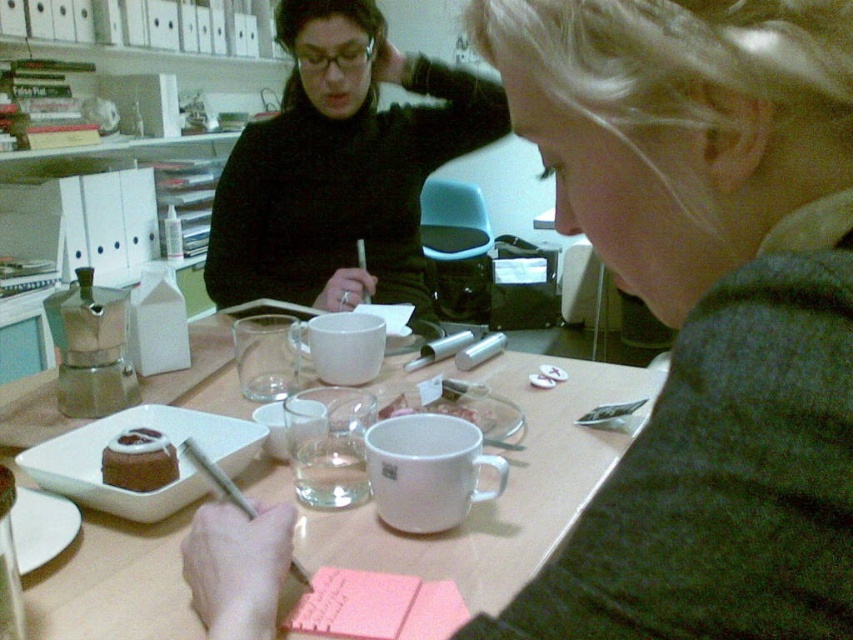
You are standing at the edge of the table looking towards the center. There are two points marked on the table surface. The first point is at coordinates point (491, 595) and the second is at point (115, 449). Which of these two points is closer to you?

Point (491, 595) is in front of point (115, 449), so it is closer to you.

You are a delivery person standing at the entrance of the room. You need to deliver a package to the black matte sweater at upper center and the chocolate frosted cake at center. Which one is closer to you?

The black matte sweater at upper center is 3.40 feet away from the chocolate frosted cake at center. Since you are at the entrance, it is unclear which one is closer without knowing their positions relative to the entrance. However, based on the given distance between them, if the entrance is equidistant from both, neither is closer. But typically, the sweater is likely on a person seated at the table, so the cake might be closer. However, the description does not specify their positions relative to theentr

You are a waiter in a restaurant. You see a white matte table at center and a chocolate frosted cake at center. Which object is placed on top of the other?

The white matte table at center is positioned over chocolate frosted cake at center, so the table is placed on top of the cake.